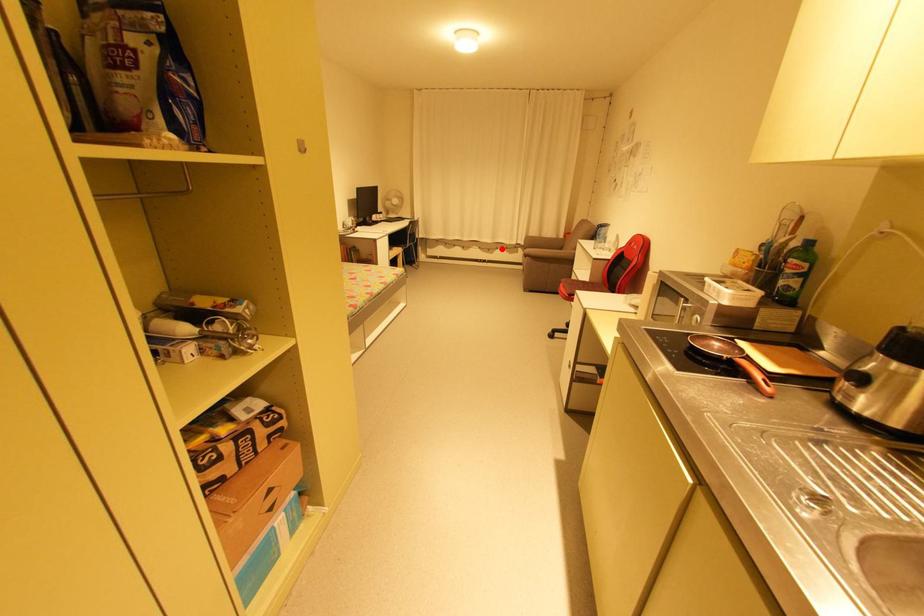
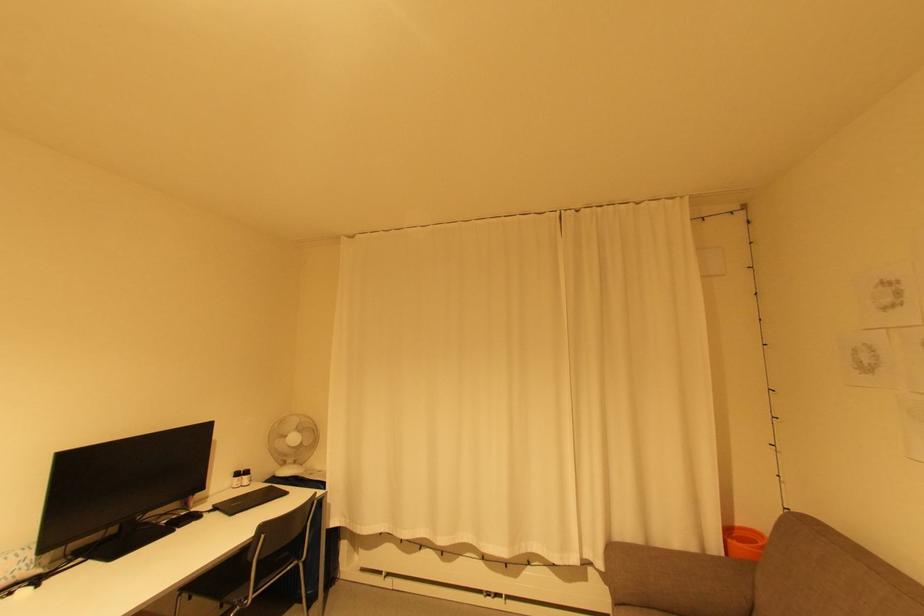
Question: I am providing you with two images of the same scene from different viewpoints. Given a red point in image1, look at the same physical point in image2. Is it:

Choices:
 (A) Closer to the viewpoint
 (B) Farther from the viewpoint

Answer: (B)